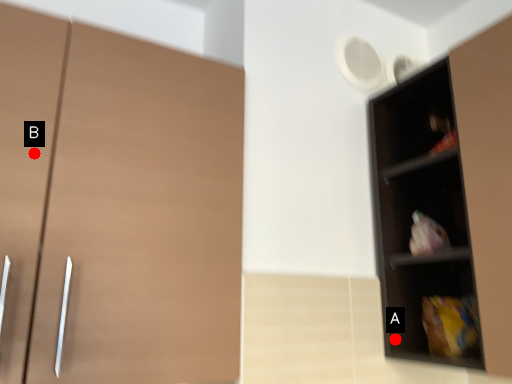
Question: Two points are circled on the image, labeled by A and B beside each circle. Which point is further to the camera?

Choices:
 (A) A is further
 (B) B is further

Answer: (A)